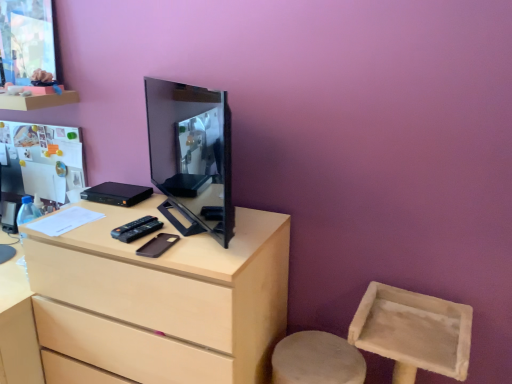
Where is `free spot above light wood chest of drawers at center (from a real-world perspective)`? This screenshot has height=384, width=512. free spot above light wood chest of drawers at center (from a real-world perspective) is located at coordinates (145, 217).